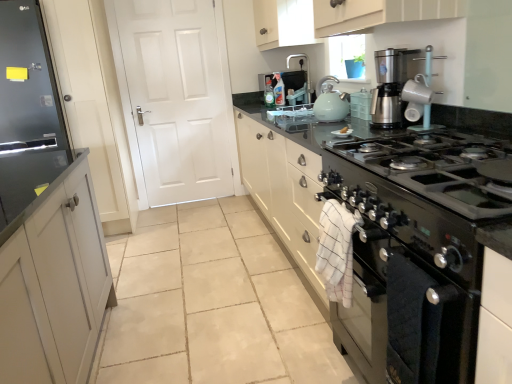
Question: Does black glass stove at center lie behind matte white mug at upper right?

Choices:
 (A) no
 (B) yes

Answer: (B)

Question: Does black glass stove at center touch matte white mug at upper right?

Choices:
 (A) no
 (B) yes

Answer: (A)

Question: Considering the relative sizes of black glass stove at center and matte white mug at upper right in the image provided, is black glass stove at center taller than matte white mug at upper right?

Choices:
 (A) no
 (B) yes

Answer: (B)

Question: From the image's perspective, is black glass stove at center on matte white mug at upper right?

Choices:
 (A) yes
 (B) no

Answer: (B)

Question: Is black glass stove at center positioned beyond the bounds of matte white mug at upper right?

Choices:
 (A) no
 (B) yes

Answer: (B)

Question: Is black glass stove at center closer to camera compared to matte white mug at upper right?

Choices:
 (A) no
 (B) yes

Answer: (A)

Question: From the image's perspective, is white matte door at center under white glossy plate at center?

Choices:
 (A) no
 (B) yes

Answer: (A)

Question: From a real-world perspective, is white matte door at center beneath white glossy plate at center?

Choices:
 (A) no
 (B) yes

Answer: (A)

Question: Is white glossy plate at center at the back of white matte door at center?

Choices:
 (A) no
 (B) yes

Answer: (A)

Question: Can you confirm if white matte door at center is smaller than white glossy plate at center?

Choices:
 (A) no
 (B) yes

Answer: (A)

Question: Considering the relative positions of white matte door at center and white glossy plate at center in the image provided, is white matte door at center behind white glossy plate at center?

Choices:
 (A) yes
 (B) no

Answer: (A)

Question: Is white matte door at center oriented towards white glossy plate at center?

Choices:
 (A) no
 (B) yes

Answer: (B)

Question: Is matte white mug at upper right completely or partially outside of matte teal kettle at upper center?

Choices:
 (A) yes
 (B) no

Answer: (A)